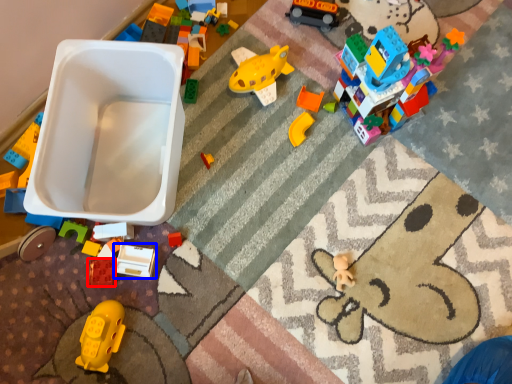
Question: Which object appears farthest to the camera in this image, toy (highlighted by a red box) or toy (highlighted by a blue box)?

Choices:
 (A) toy
 (B) toy

Answer: (A)